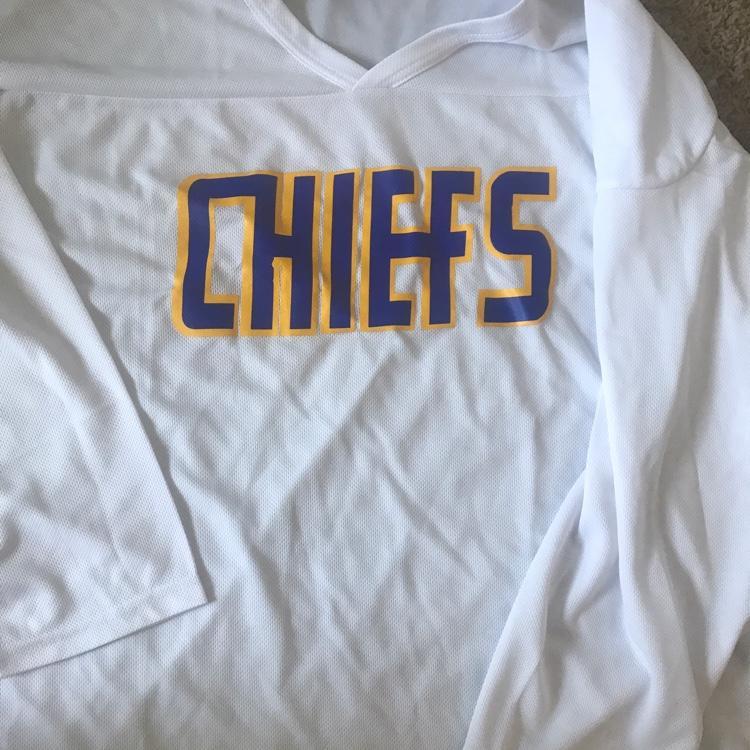
Where is `white carpet`? white carpet is located at coordinates (706, 31).